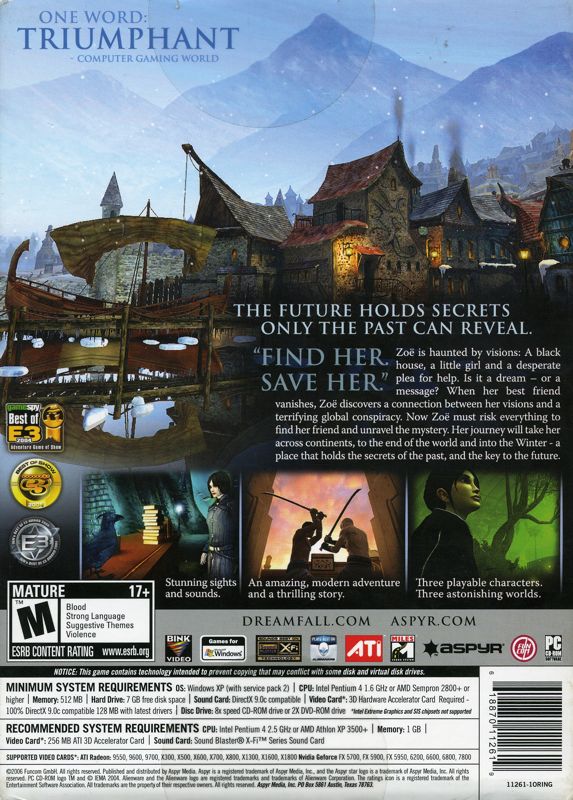
At what (x,y) coordinates should I click in order to perform the action: click on light. Please return your answer as a coordinate pair (x, y). This screenshot has height=800, width=573. Looking at the image, I should click on (344, 250).